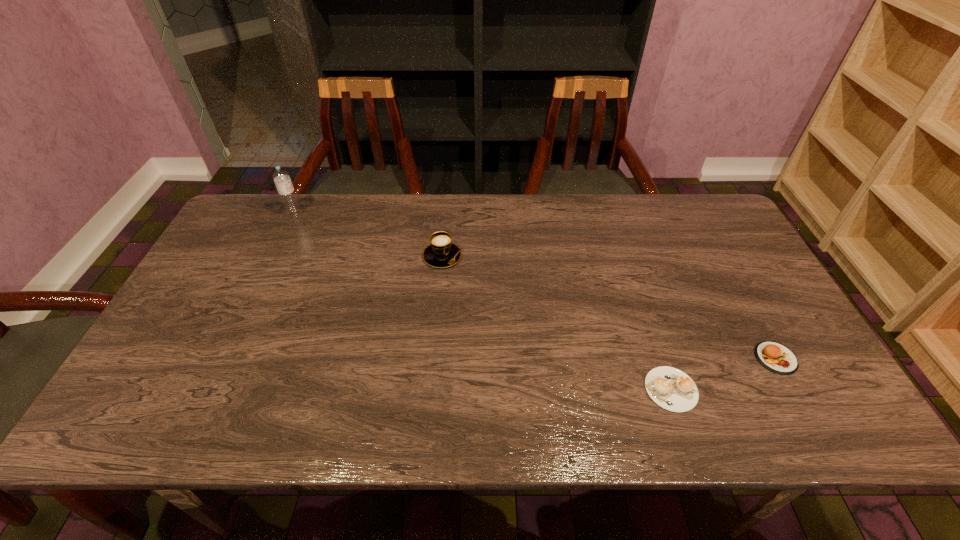
Image resolution: width=960 pixels, height=540 pixels. I want to click on free space between the water bottle and the left cappuccino, so click(369, 235).

Locate an element on the screen. This screenshot has height=540, width=960. free space between the rightmost object and the second tallest object is located at coordinates (610, 307).

You are a GUI agent. You are given a task and a screenshot of the screen. Output one action in this format:
    pyautogui.click(x=<x>, y=<y>)
    Task: Click on the object identified as the closest to the third tallest object
    The image size is (960, 540).
    Given the screenshot: What is the action you would take?
    pyautogui.click(x=670, y=388)

Image resolution: width=960 pixels, height=540 pixels. In order to click on object that is the second closest to the taller cappuccino in this screenshot , I will do `click(670, 388)`.

Image resolution: width=960 pixels, height=540 pixels. Identify the location of free location that satisfies the following two spatial constraints: 1. on the front side of the second farthest object; 2. on the left side of the nearer cappuccino. (431, 389).

Locate an element on the screen. vacant region that satisfies the following two spatial constraints: 1. on the front side of the shorter cappuccino; 2. on the left side of the water bottle is located at coordinates (213, 389).

Locate an element on the screen. free location that satisfies the following two spatial constraints: 1. on the front side of the third nearest object; 2. on the right side of the second shortest object is located at coordinates pos(434,358).